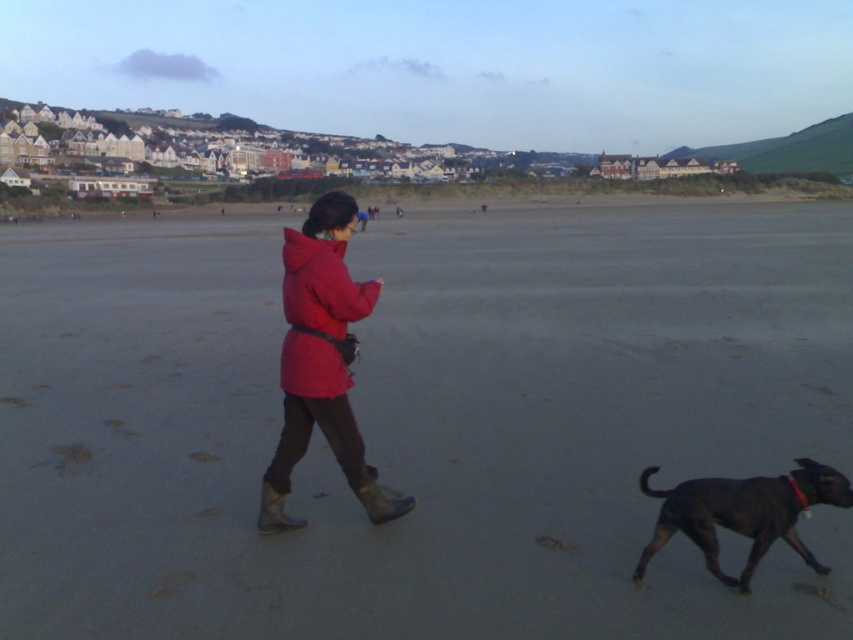
Who is taller, gray sand at center or shiny black dog at lower right?

Standing taller between the two is gray sand at center.

Does gray sand at center have a smaller size compared to shiny black dog at lower right?

Actually, gray sand at center might be larger than shiny black dog at lower right.

Identify the location of gray sand at center. The image size is (853, 640). (421, 426).

At what (x,y) coordinates should I click in order to perform the action: click on gray sand at center. Please return your answer as a coordinate pair (x, y). Looking at the image, I should click on (421, 426).

The height and width of the screenshot is (640, 853). Describe the element at coordinates (421, 426) in the screenshot. I see `gray sand at center` at that location.

Does gray sand at center lie behind matte red jacket at center?

No, gray sand at center is in front of matte red jacket at center.

Between point (334, 488) and point (285, 280), which one is positioned behind?

Point (334, 488)

Locate an element on the screen. The width and height of the screenshot is (853, 640). gray sand at center is located at coordinates click(421, 426).

Does shiny black dog at lower right have a greater height compared to matte red jacket at center?

Incorrect, shiny black dog at lower right's height is not larger of matte red jacket at center's.

Is point (636, 563) more distant than point (294, 362)?

No.

Where is `shiny black dog at lower right`? shiny black dog at lower right is located at coordinates (743, 513).